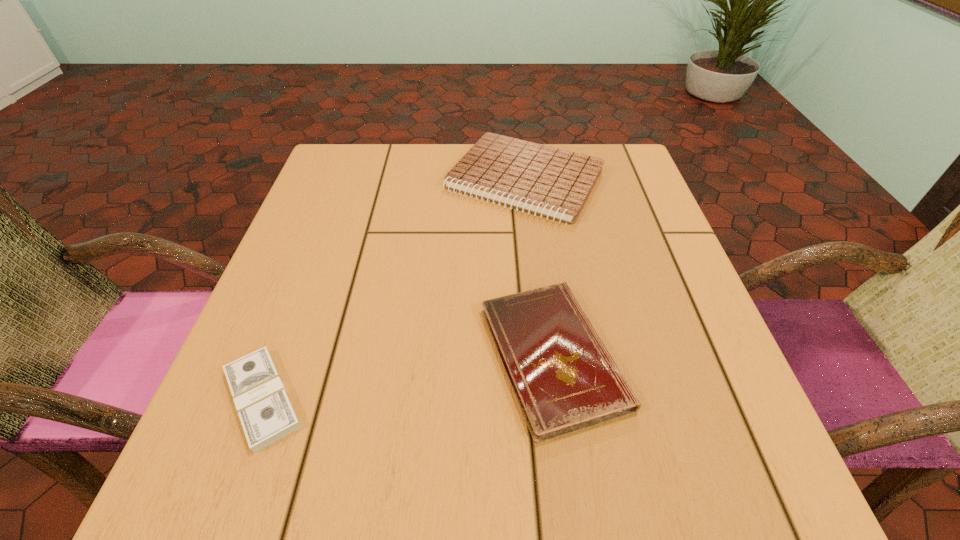
Locate an element on the screen. This screenshot has height=540, width=960. the farther notebook is located at coordinates (553, 182).

Where is `the taller notebook`? This screenshot has height=540, width=960. the taller notebook is located at coordinates (553, 182).

Identify the location of the nearer notebook. (564, 378).

Locate an element on the screen. This screenshot has height=540, width=960. the shorter notebook is located at coordinates (564, 378).

Locate an element on the screen. The width and height of the screenshot is (960, 540). the leftmost object is located at coordinates click(265, 411).

Locate an element on the screen. the shortest object is located at coordinates (265, 411).

This screenshot has height=540, width=960. Find the location of `free point located on the right of the tallest object`. free point located on the right of the tallest object is located at coordinates (643, 180).

You are a GUI agent. You are given a task and a screenshot of the screen. Output one action in this format:
    pyautogui.click(x=<x>, y=<y>)
    Task: Click on the free location located 0.140m on the right of the shorter notebook
    The height and width of the screenshot is (540, 960).
    Given the screenshot: What is the action you would take?
    pyautogui.click(x=712, y=356)

Where is `vacant area situated on the back of the leftmost object`? This screenshot has width=960, height=540. vacant area situated on the back of the leftmost object is located at coordinates [x=324, y=237].

Where is `object at the far edge`? The width and height of the screenshot is (960, 540). object at the far edge is located at coordinates coord(553,182).